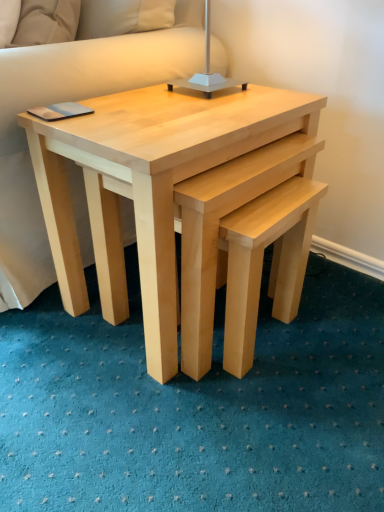
You are a GUI agent. You are given a task and a screenshot of the screen. Output one action in this format:
    pyautogui.click(x=<x>, y=<y>)
    Task: Click on the free spot above natural wood nesting tables at center (from a real-world perspective)
    The image size is (384, 512).
    Given the screenshot: What is the action you would take?
    pyautogui.click(x=178, y=104)